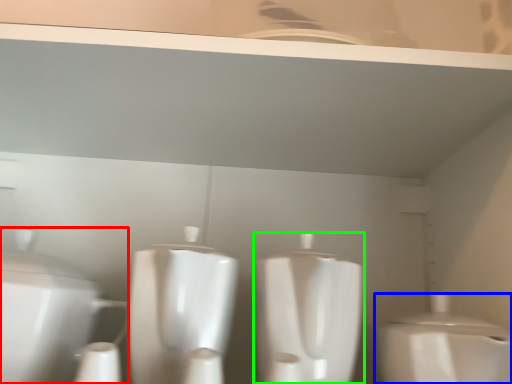
Question: Estimate the real-world distances between objects in this image. Which object is closer to toilet (highlighted by a red box), toilet (highlighted by a blue box) or toilet (highlighted by a green box)?

Choices:
 (A) toilet
 (B) toilet

Answer: (B)